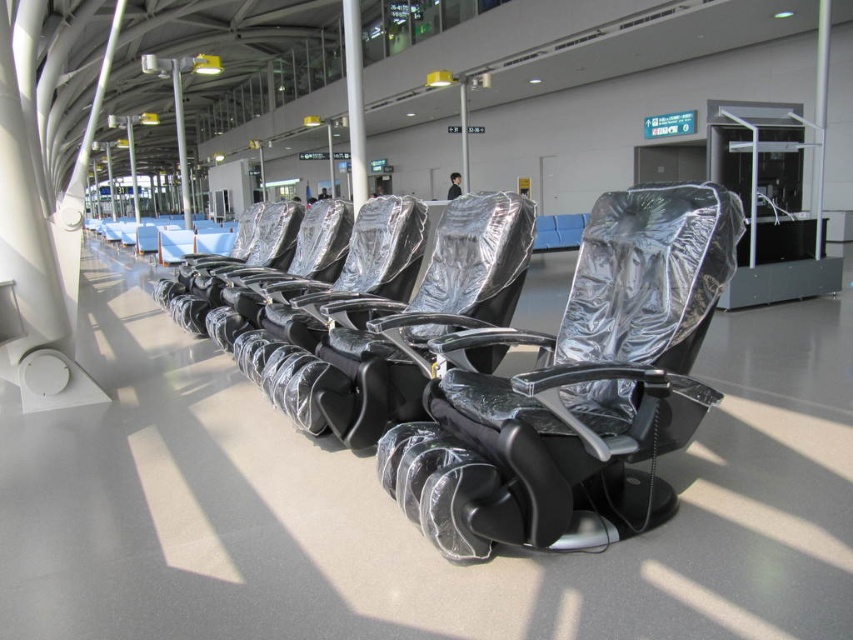
Question: From the image, what is the correct spatial relationship of shiny black leather chair at center in relation to shiny metallic seat at center?

Choices:
 (A) below
 (B) above

Answer: (A)

Question: Among these points, which one is nearest to the camera?

Choices:
 (A) (315, 250)
 (B) (428, 454)
 (C) (460, 220)

Answer: (B)

Question: Which object is farther from the camera taking this photo?

Choices:
 (A) shiny metallic seat at center
 (B) shiny black leather chair at center

Answer: (A)

Question: Among these objects, which one is nearest to the camera?

Choices:
 (A) metallic silver chair at center
 (B) shiny metallic seat at center

Answer: (B)

Question: Is shiny metallic seat at center positioned at the back of metallic silver chair at center?

Choices:
 (A) no
 (B) yes

Answer: (A)

Question: Can you confirm if shiny black leather chair at center is positioned below metallic silver chair at center?

Choices:
 (A) no
 (B) yes

Answer: (B)